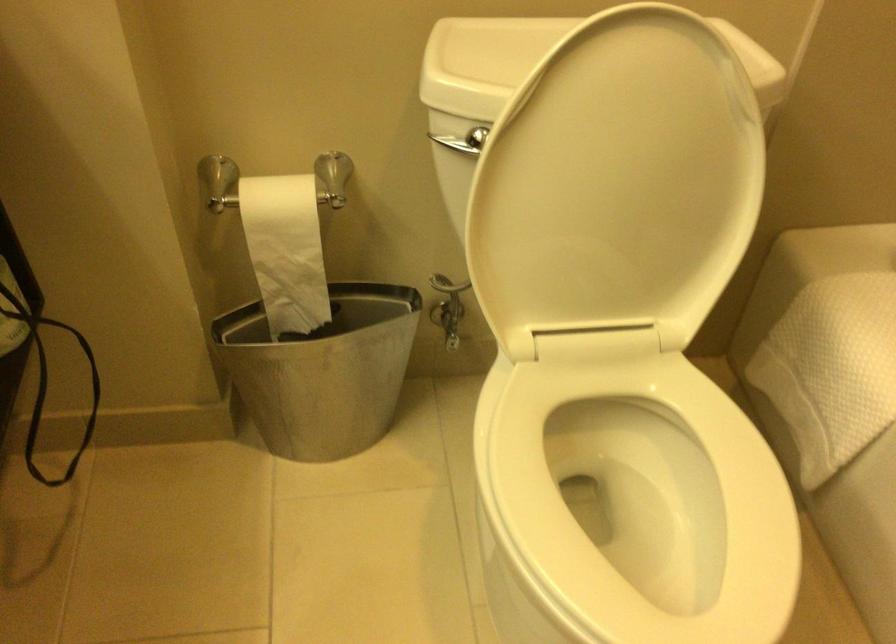
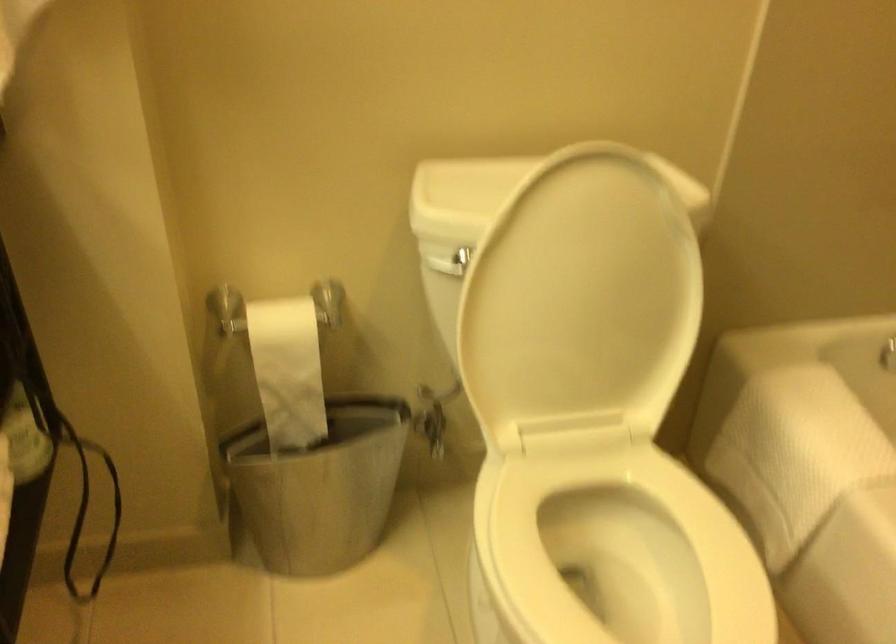
Question: The first image is from the beginning of the video and the second image is from the end. How did the camera likely rotate when shooting the video?

Choices:
 (A) Left
 (B) Right
 (C) Up
 (D) Down

Answer: (C)